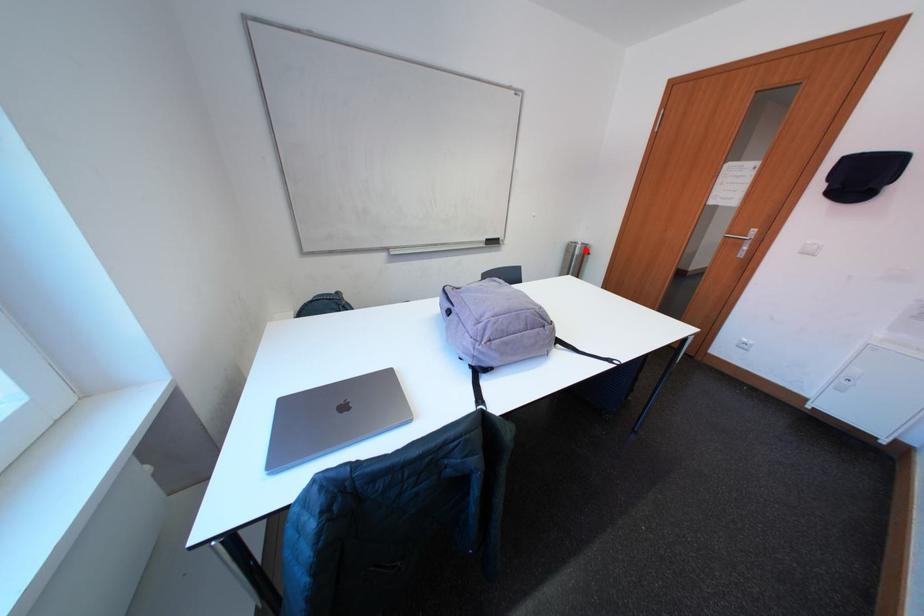
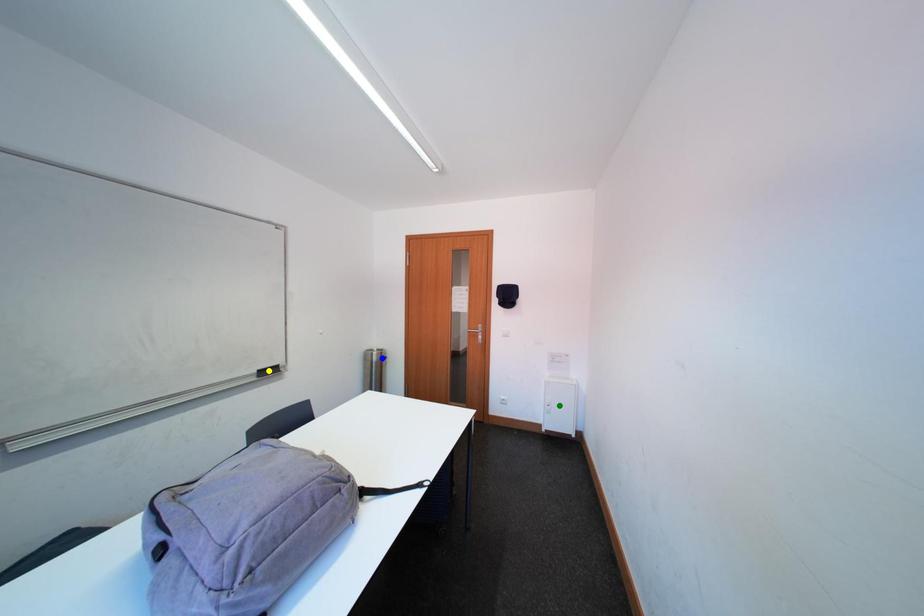
Question: I am providing you with two images of the same scene from different viewpoints. A red point is marked on the first image. You are given multiple points on the second image. In image 2, which mark is for the same physical point as the one in image 1?

Choices:
 (A) blue point
 (B) green point
 (C) yellow point

Answer: (A)